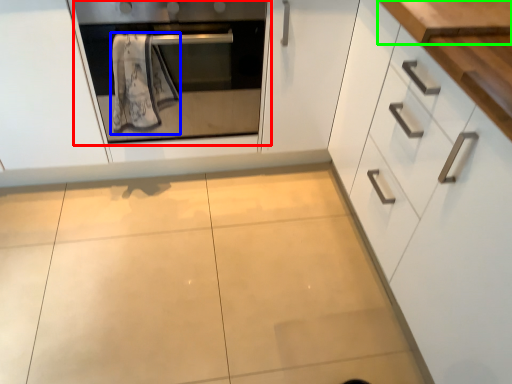
Question: Which object is the farthest from oven (highlighted by a red box)? Choose among these: bath towel (highlighted by a blue box) or counter top (highlighted by a green box).

Choices:
 (A) bath towel
 (B) counter top

Answer: (B)